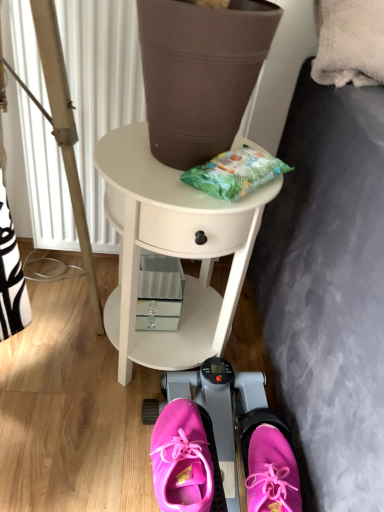
Where is `pink fabric sneakers at center`? The height and width of the screenshot is (512, 384). pink fabric sneakers at center is located at coordinates (184, 458).

What do you see at coordinates (269, 463) in the screenshot? Image resolution: width=384 pixels, height=512 pixels. I see `pink fabric sneakers at lower center, arranged as the 1th footwear when viewed from the right` at bounding box center [269, 463].

Locate an element on the screen. Image resolution: width=384 pixels, height=512 pixels. wooden tripod at left is located at coordinates (63, 130).

The height and width of the screenshot is (512, 384). What are the coordinates of `white glossy side table at center` in the screenshot? It's located at (172, 251).

Is pink fabric sneakers at lower center, arranged as the 1th footwear when viewed from the right, at the left side of pink fabric sneakers at center?

No.

Locate an element on the screen. couple below the pink fabric sneakers at lower center, placed as the second footwear when sorted from left to right (from the image's perspective) is located at coordinates (184, 458).

Who is taller, pink fabric sneakers at lower center, arranged as the 1th footwear when viewed from the right, or pink fabric sneakers at center?

With more height is pink fabric sneakers at center.

Is pink fabric sneakers at lower center, placed as the second footwear when sorted from left to right, facing away from pink fabric sneakers at center?

pink fabric sneakers at lower center, placed as the second footwear when sorted from left to right, is not turned away from pink fabric sneakers at center.

Locate an element on the screen. Image resolution: width=384 pixels, height=512 pixels. ladder that appears behind the pink fabric sneakers at center is located at coordinates (63, 130).

Looking at the image, does pink fabric sneakers at center seem bigger or smaller compared to wooden tripod at left?

pink fabric sneakers at center is smaller than wooden tripod at left.

Considering the sizes of pink fabric sneakers at center and wooden tripod at left in the image, is pink fabric sneakers at center taller or shorter than wooden tripod at left?

pink fabric sneakers at center is shorter than wooden tripod at left.

Is pink fabric shoe at lower center, which is counted as the 1th footwear, starting from the left, wider or thinner than pink fabric sneakers at lower center, arranged as the 1th footwear when viewed from the right?

Considering their sizes, pink fabric shoe at lower center, which is counted as the 1th footwear, starting from the left, looks broader than pink fabric sneakers at lower center, arranged as the 1th footwear when viewed from the right.

Considering the relative sizes of pink fabric shoe at lower center, the second footwear in the right-to-left sequence, and pink fabric sneakers at lower center, arranged as the 1th footwear when viewed from the right, in the image provided, is pink fabric shoe at lower center, the second footwear in the right-to-left sequence, bigger than pink fabric sneakers at lower center, arranged as the 1th footwear when viewed from the right,?

No.

Could you tell me if pink fabric shoe at lower center, which is counted as the 1th footwear, starting from the left, is facing pink fabric sneakers at lower center, arranged as the 1th footwear when viewed from the right?

No, pink fabric shoe at lower center, which is counted as the 1th footwear, starting from the left, is not aimed at pink fabric sneakers at lower center, arranged as the 1th footwear when viewed from the right.

Is point (191, 478) positioned behind point (292, 505)?

No, (191, 478) is in front of (292, 505).

Is pink fabric sneakers at lower center, arranged as the 1th footwear when viewed from the right, positioned far away from white glossy side table at center?

No.

From a real-world perspective, which object stands above the other?

From a 3D spatial view, white glossy side table at center is above.

How many degrees apart are the facing directions of pink fabric sneakers at lower center, placed as the second footwear when sorted from left to right, and white glossy side table at center?

0.0001 degrees.

In the scene shown: Is pink fabric shoe at lower center, the second footwear in the right-to-left sequence, not near white glossy side table at center?

No, pink fabric shoe at lower center, the second footwear in the right-to-left sequence, is not far away from white glossy side table at center.

How much distance is there between pink fabric shoe at lower center, which is counted as the 1th footwear, starting from the left, and white glossy side table at center?

13.86 inches.

I want to click on footwear that is the 1st one when counting forward from the white glossy side table at center, so click(x=181, y=459).

How many degrees apart are the facing directions of white glossy side table at center and pink fabric shoe at lower center, the second footwear in the right-to-left sequence?

white glossy side table at center and pink fabric shoe at lower center, the second footwear in the right-to-left sequence, are facing 9.02e-05 degrees away from each other.

From the image's perspective, is white glossy side table at center above pink fabric shoe at lower center, the second footwear in the right-to-left sequence?

Yes, from the image's perspective, white glossy side table at center is on top of pink fabric shoe at lower center, the second footwear in the right-to-left sequence.

Can you confirm if white glossy side table at center is wider than pink fabric shoe at lower center, which is counted as the 1th footwear, starting from the left?

Yes, white glossy side table at center is wider than pink fabric shoe at lower center, which is counted as the 1th footwear, starting from the left.

Which of these two, pink fabric sneakers at lower center, placed as the second footwear when sorted from left to right, or wooden tripod at left, is wider?

pink fabric sneakers at lower center, placed as the second footwear when sorted from left to right.

Considering the relative sizes of pink fabric sneakers at lower center, arranged as the 1th footwear when viewed from the right, and wooden tripod at left in the image provided, is pink fabric sneakers at lower center, arranged as the 1th footwear when viewed from the right, smaller than wooden tripod at left?

Indeed, pink fabric sneakers at lower center, arranged as the 1th footwear when viewed from the right, has a smaller size compared to wooden tripod at left.

From a real-world perspective, which footwear is the 2nd one underneath the wooden tripod at left? Please provide its 2D coordinates.

[(269, 463)]

From the image's perspective, is pink fabric sneakers at lower center, arranged as the 1th footwear when viewed from the right, located beneath wooden tripod at left?

Indeed, from the image's perspective, pink fabric sneakers at lower center, arranged as the 1th footwear when viewed from the right, is shown beneath wooden tripod at left.

Identify the location of couple below the pink fabric sneakers at lower center, placed as the second footwear when sorted from left to right (from the image's perspective). (184, 458).

What are the coordinates of `couple on the right side of wooden tripod at left` in the screenshot? It's located at (184, 458).

Estimate the real-world distances between objects in this image. Which object is closer to pink fabric shoe at lower center, the second footwear in the right-to-left sequence, pink fabric sneakers at center or pink fabric sneakers at lower center, placed as the second footwear when sorted from left to right?

Based on the image, pink fabric sneakers at center appears to be nearer to pink fabric shoe at lower center, the second footwear in the right-to-left sequence.

Looking at the image, which one is located further to white glossy side table at center, pink fabric shoe at lower center, which is counted as the 1th footwear, starting from the left, or wooden tripod at left?

The object further to white glossy side table at center is pink fabric shoe at lower center, which is counted as the 1th footwear, starting from the left.

Estimate the real-world distances between objects in this image. Which object is further from pink fabric sneakers at lower center, placed as the second footwear when sorted from left to right, wooden tripod at left or white glossy side table at center?

wooden tripod at left lies further to pink fabric sneakers at lower center, placed as the second footwear when sorted from left to right, than the other object.

Based on their spatial positions, is pink fabric sneakers at center or wooden tripod at left further from pink fabric shoe at lower center, the second footwear in the right-to-left sequence?

Among the two, wooden tripod at left is located further to pink fabric shoe at lower center, the second footwear in the right-to-left sequence.

Considering their positions, is white glossy side table at center positioned closer to wooden tripod at left than pink fabric sneakers at center?

The object closer to wooden tripod at left is white glossy side table at center.

Based on their spatial positions, is wooden tripod at left or pink fabric sneakers at lower center, placed as the second footwear when sorted from left to right, further from pink fabric sneakers at center?

wooden tripod at left.

When comparing their distances from pink fabric sneakers at lower center, arranged as the 1th footwear when viewed from the right, does wooden tripod at left or pink fabric sneakers at center seem further?

wooden tripod at left is positioned further to the anchor pink fabric sneakers at lower center, arranged as the 1th footwear when viewed from the right.

When comparing their distances from pink fabric sneakers at lower center, placed as the second footwear when sorted from left to right, does pink fabric sneakers at center or pink fabric shoe at lower center, the second footwear in the right-to-left sequence, seem further?

pink fabric shoe at lower center, the second footwear in the right-to-left sequence, is positioned further to the anchor pink fabric sneakers at lower center, placed as the second footwear when sorted from left to right.

Where is `footwear between wooden tripod at left and pink fabric sneakers at lower center, arranged as the 1th footwear when viewed from the right, from top to bottom`? footwear between wooden tripod at left and pink fabric sneakers at lower center, arranged as the 1th footwear when viewed from the right, from top to bottom is located at coordinates (181, 459).

Find the location of `footwear between white glossy side table at center and pink fabric sneakers at lower center, placed as the second footwear when sorted from left to right, in the vertical direction`. footwear between white glossy side table at center and pink fabric sneakers at lower center, placed as the second footwear when sorted from left to right, in the vertical direction is located at coordinates tap(181, 459).

Locate an element on the screen. desk that lies between wooden tripod at left and pink fabric sneakers at lower center, arranged as the 1th footwear when viewed from the right, from top to bottom is located at coordinates (172, 251).

The width and height of the screenshot is (384, 512). What are the coordinates of `desk that lies between wooden tripod at left and pink fabric shoe at lower center, the second footwear in the right-to-left sequence, from top to bottom` in the screenshot? It's located at (x=172, y=251).